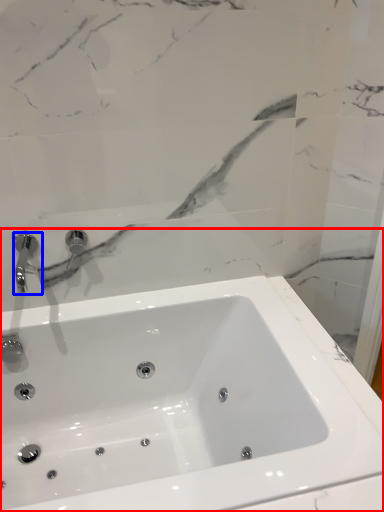
Question: Which object appears closest to the camera in this image, sink (highlighted by a red box) or tap (highlighted by a blue box)?

Choices:
 (A) sink
 (B) tap

Answer: (A)